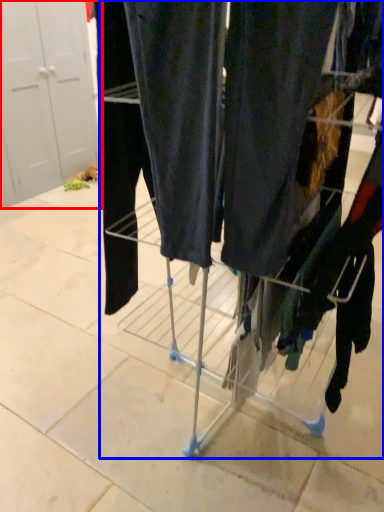
Question: Which point is closer to the camera, door (highlighted by a red box) or trolley (highlighted by a blue box)?

Choices:
 (A) door
 (B) trolley

Answer: (B)